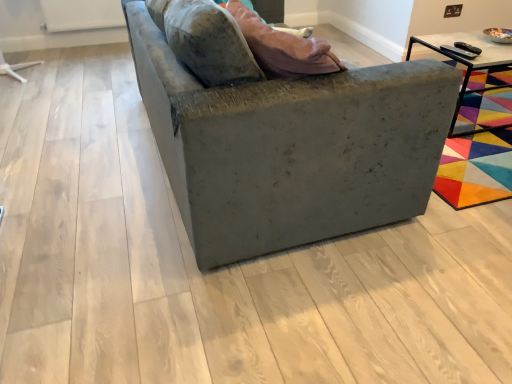
Question: Should I look upward or downward to see black metal table at upper right?

Choices:
 (A) down
 (B) up

Answer: (B)

Question: Does velvet gray couch at center come behind black metal table at upper right?

Choices:
 (A) yes
 (B) no

Answer: (B)

Question: Is velvet gray couch at center at the right side of black metal table at upper right?

Choices:
 (A) yes
 (B) no

Answer: (B)

Question: Does velvet gray couch at center have a smaller size compared to black metal table at upper right?

Choices:
 (A) yes
 (B) no

Answer: (B)

Question: Can you confirm if velvet gray couch at center is thinner than black metal table at upper right?

Choices:
 (A) yes
 (B) no

Answer: (B)

Question: Can you confirm if velvet gray couch at center is wider than black metal table at upper right?

Choices:
 (A) no
 (B) yes

Answer: (B)

Question: Is velvet gray couch at center far away from black metal table at upper right?

Choices:
 (A) no
 (B) yes

Answer: (B)

Question: Is black metal table at upper right outside velvet gray couch at center?

Choices:
 (A) yes
 (B) no

Answer: (A)

Question: Is black metal table at upper right closer to the viewer compared to velvet gray couch at center?

Choices:
 (A) yes
 (B) no

Answer: (B)

Question: From a real-world perspective, is black metal table at upper right positioned over velvet gray couch at center based on gravity?

Choices:
 (A) no
 (B) yes

Answer: (A)

Question: From a real-world perspective, is black metal table at upper right located beneath velvet gray couch at center?

Choices:
 (A) no
 (B) yes

Answer: (B)

Question: Is black metal table at upper right smaller than velvet gray couch at center?

Choices:
 (A) yes
 (B) no

Answer: (A)

Question: From the image's perspective, would you say black metal table at upper right is shown under velvet gray couch at center?

Choices:
 (A) yes
 (B) no

Answer: (B)

Question: From a real-world perspective, is black metal table at upper right positioned above or below velvet gray couch at center?

Choices:
 (A) below
 (B) above

Answer: (A)